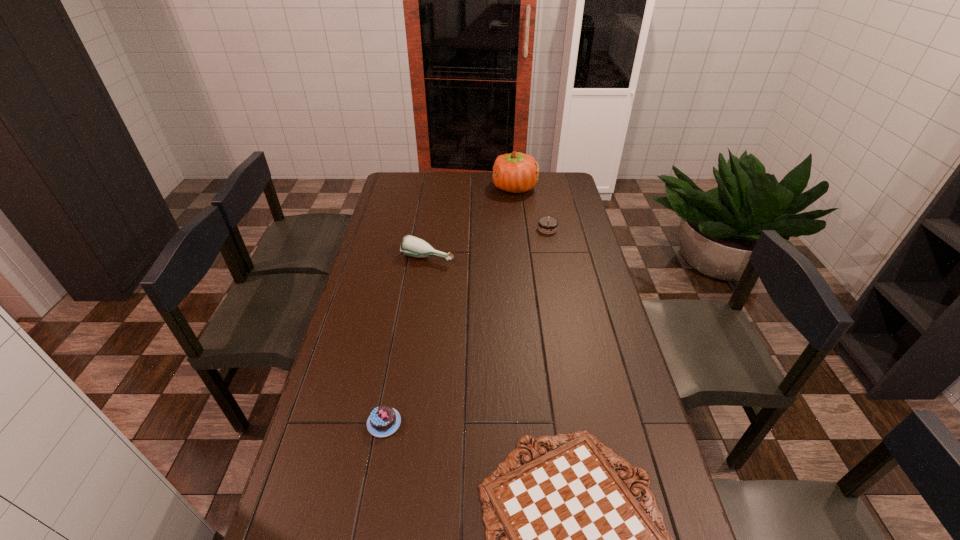
In order to click on blank space located on the side of the pumpkin with the cute face in this screenshot , I will do `click(476, 188)`.

What are the coordinates of `free point located 0.370m on the right of the fourth shortest object` in the screenshot? It's located at (545, 257).

Image resolution: width=960 pixels, height=540 pixels. In order to click on vacant space located 0.370m on the left of the taller chocolate cake in this screenshot , I will do `click(453, 229)`.

This screenshot has width=960, height=540. Identify the location of free location located on the back of the second shortest object. (393, 376).

Locate an element on the screen. object at the far edge is located at coordinates (516, 172).

The image size is (960, 540). Find the location of `bottle that is at the left edge`. bottle that is at the left edge is located at coordinates (412, 246).

Where is `chocolate cake at the left edge`? Image resolution: width=960 pixels, height=540 pixels. chocolate cake at the left edge is located at coordinates (384, 420).

I want to click on object that is at the right edge, so click(x=548, y=225).

Where is `free space at the far edge`? The height and width of the screenshot is (540, 960). free space at the far edge is located at coordinates (466, 191).

At what (x,y) coordinates should I click in order to perform the action: click on free spot at the left edge of the desktop. Please return your answer as a coordinate pair (x, y). This screenshot has width=960, height=540. Looking at the image, I should click on (381, 283).